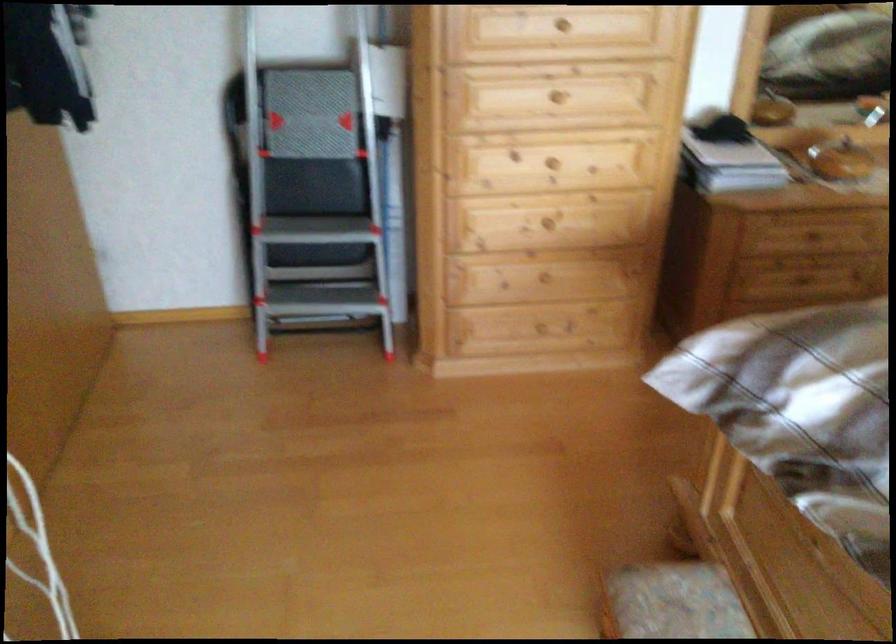
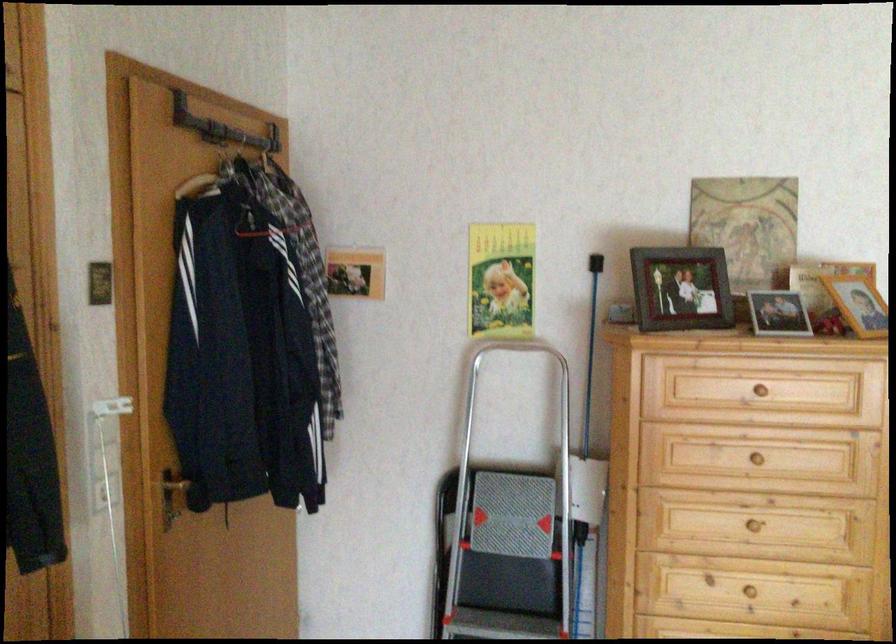
Locate, in the second image, the point that corresponds to point (547, 97) in the first image.

(754, 526)